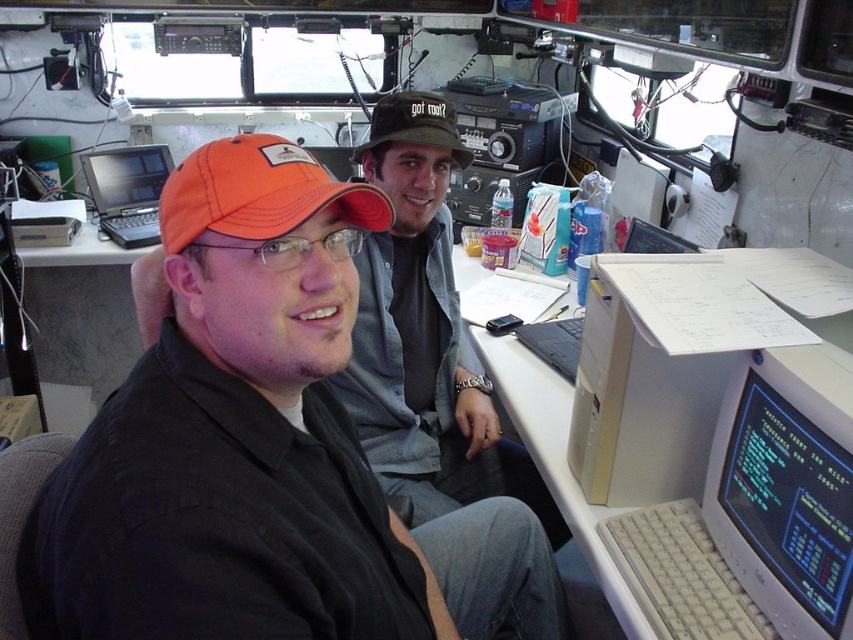
Is orange fabric cap at center positioned before white plastic computer at center?

Yes, orange fabric cap at center is in front of white plastic computer at center.

Can you confirm if orange fabric cap at center is smaller than white plastic computer at center?

Yes.

Where is `orange fabric cap at center`? orange fabric cap at center is located at coordinates (258, 193).

I want to click on orange fabric cap at center, so click(258, 193).

Between white plastic computer desk at center and matte black laptop at left, which one appears on the right side from the viewer's perspective?

Positioned to the right is white plastic computer desk at center.

Between point (625, 612) and point (149, 198), which one is positioned in front?

Positioned in front is point (625, 612).

Between point (569, 296) and point (90, 152), which one is positioned behind?

Point (90, 152)

At what (x,y) coordinates should I click in order to perform the action: click on white plastic computer desk at center. Please return your answer as a coordinate pair (x, y). The image size is (853, 640). Looking at the image, I should click on (556, 458).

Does matte black shirt at center appear on the left side of orange fabric cap at center?

No, matte black shirt at center is not to the left of orange fabric cap at center.

Does point (360, 224) lie behind point (318, 180)?

That is True.

What do you see at coordinates (262, 451) in the screenshot?
I see `matte black shirt at center` at bounding box center [262, 451].

I want to click on matte black shirt at center, so click(262, 451).